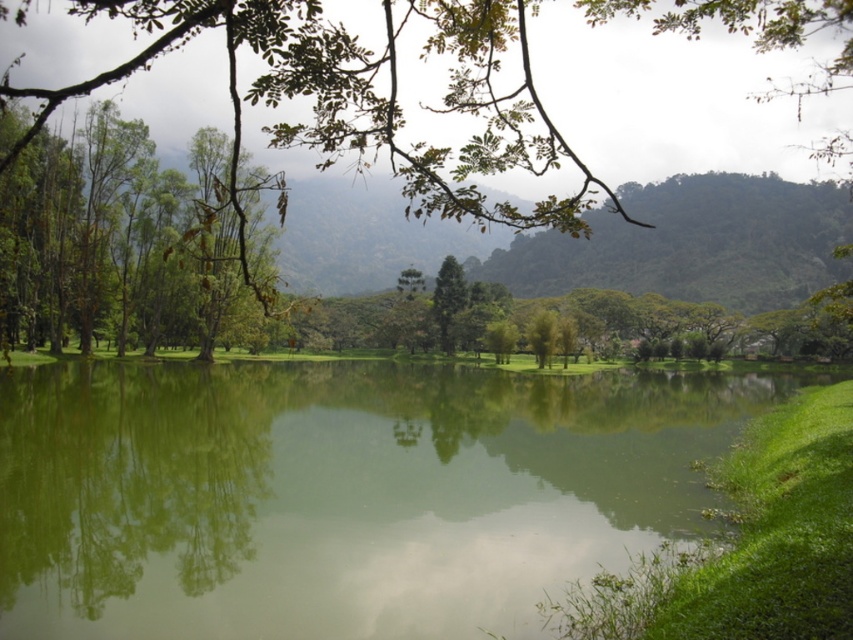
You are standing at the edge of the water in the image and want to walk to the base of the green leafy tree at center. Which direction should you head towards, relative to the green leafy tree at upper left?

You should head towards the direction opposite of the green leafy tree at upper left because the green leafy tree at center is taller and likely located in the central area of the scene.

You are standing at the edge of the water and see the green leafy tree at center and the green leafy tree at upper left. Which tree is closer to you?

The green leafy tree at center is closer to you because it is in front of the green leafy tree at upper left.